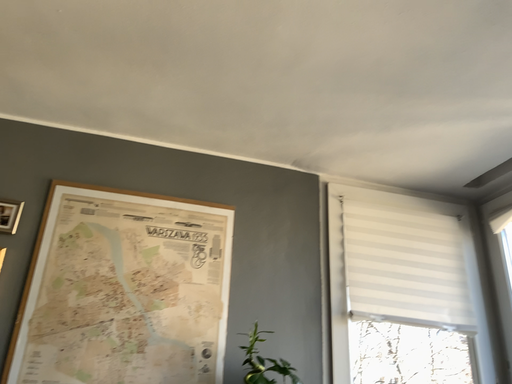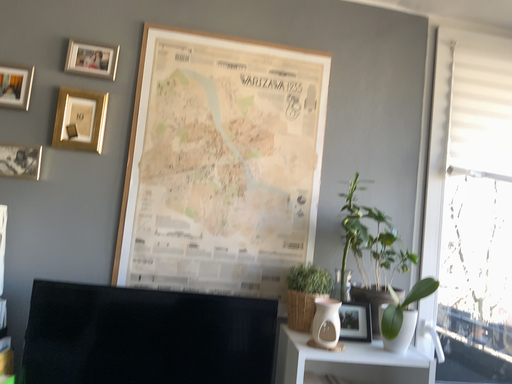
Question: How did the camera likely rotate when shooting the video?

Choices:
 (A) rotated right
 (B) rotated left

Answer: (B)